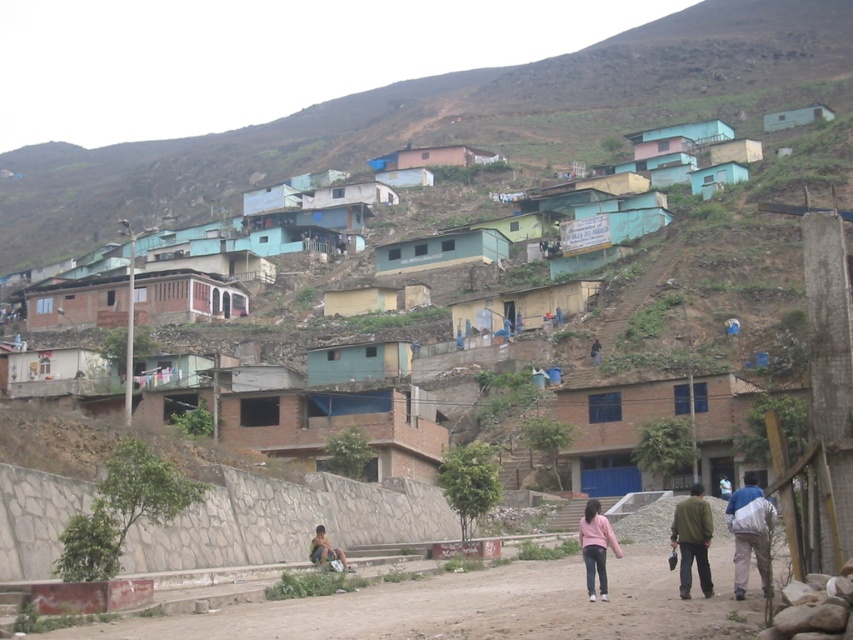
Question: Does green matte building at center appear on the left side of light blue corrugated metal hut at upper center?

Choices:
 (A) no
 (B) yes

Answer: (B)

Question: Does white fabric bag at lower right come behind light blue shirt at center?

Choices:
 (A) yes
 (B) no

Answer: (B)

Question: Which point is closer to the camera?

Choices:
 (A) dark brown leather jacket at center
 (B) green matte building at center
 (C) pink fabric at center
 (D) blue corrugated metal hut at center

Answer: (C)

Question: Which object is positioned farthest from the brick wall house at center?

Choices:
 (A) green matte jacket at lower right
 (B) light blue corrugated metal hut at upper right
 (C) blue painted houses at upper center
 (D) light blue corrugated metal hut at upper center

Answer: (C)

Question: Can you confirm if green matte building at center is positioned to the left of light blue corrugated metal hut at upper center?

Choices:
 (A) no
 (B) yes

Answer: (B)

Question: Which point appears farthest from the camera in this image?

Choices:
 (A) (672, 132)
 (B) (144, 632)

Answer: (A)